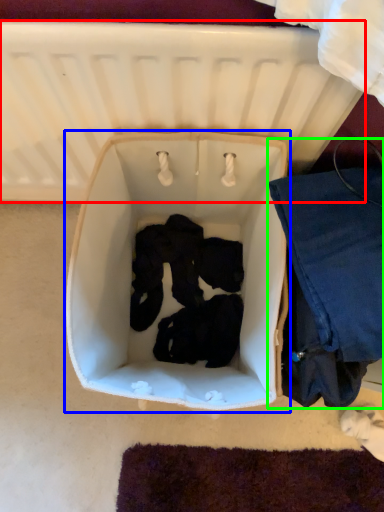
Question: Based on their relative distances, which object is nearer to infant bed (highlighted by a red box)? Choose from baby carriage (highlighted by a blue box) and clothing (highlighted by a green box).

Choices:
 (A) baby carriage
 (B) clothing

Answer: (A)